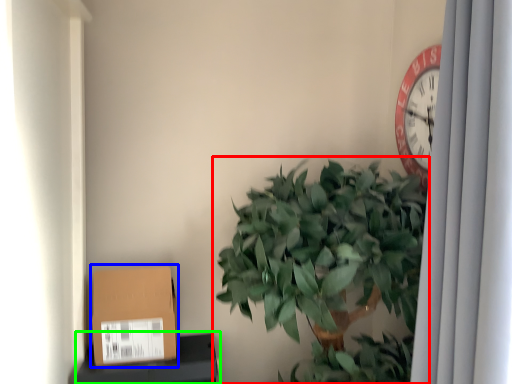
Question: Which object is the closest to the houseplant (highlighted by a red box)? Choose among these: cardboard box (highlighted by a blue box) or furniture (highlighted by a green box).

Choices:
 (A) cardboard box
 (B) furniture

Answer: (A)